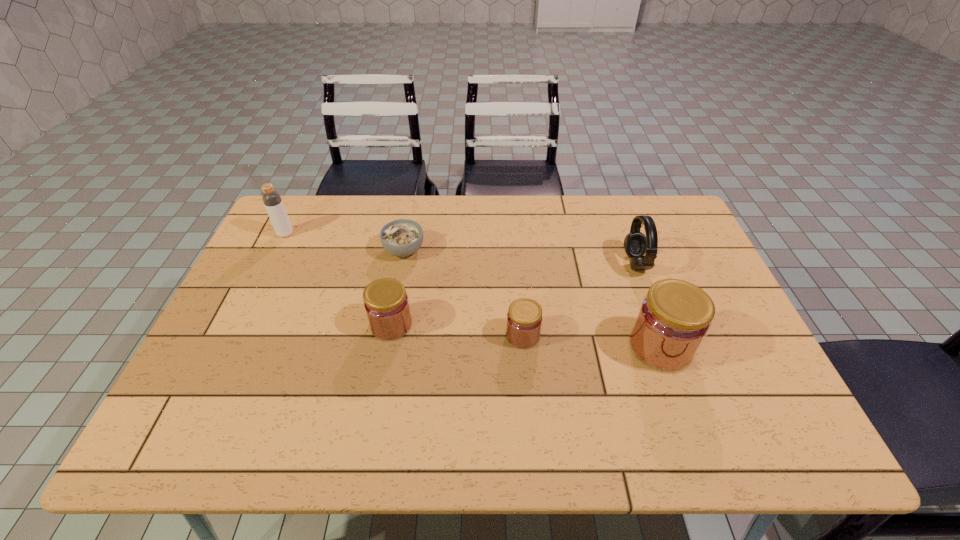
Where is `object that is at the far left corner`? object that is at the far left corner is located at coordinates (271, 198).

This screenshot has height=540, width=960. Find the location of `blank space at the far edge`. blank space at the far edge is located at coordinates (349, 213).

You are a GUI agent. You are given a task and a screenshot of the screen. Output one action in this format:
    pyautogui.click(x=<x>, y=<y>)
    Task: Click on the free region at the near edge of the desktop
    
    Given the screenshot: What is the action you would take?
    pyautogui.click(x=341, y=388)

Locate an element on the screen. This screenshot has width=960, height=540. vacant area at the left edge of the desktop is located at coordinates (278, 293).

In the image, there is a desktop. Where is `vacant space at the right edge`? This screenshot has height=540, width=960. vacant space at the right edge is located at coordinates (725, 368).

In the image, there is a desktop. At what (x,y) coordinates should I click in order to perform the action: click on vacant space at the near left corner. Please return your answer as a coordinate pair (x, y). The image size is (960, 540). Looking at the image, I should click on 217,400.

The image size is (960, 540). In the image, there is a desktop. Identify the location of free region at the far right corner. (681, 218).

Find the location of a particular element. free space between the rightmost jam and the shortest object is located at coordinates (532, 299).

Locate an element on the screen. The height and width of the screenshot is (540, 960). free spot between the third shortest object and the headset is located at coordinates (514, 294).

Image resolution: width=960 pixels, height=540 pixels. What are the coordinates of `free spot between the shortest jam and the soup bowl` in the screenshot? It's located at (464, 293).